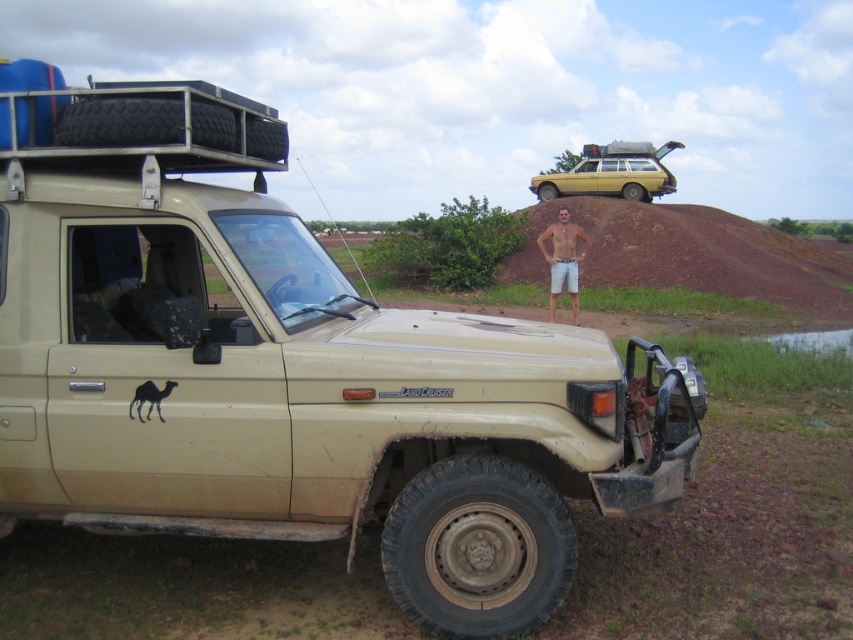
Question: Can you confirm if yellow matte station wagon at upper center is positioned to the right of tan shorts at center?

Choices:
 (A) no
 (B) yes

Answer: (B)

Question: Where is yellow matte station wagon at upper center located in relation to tan shorts at center in the image?

Choices:
 (A) left
 (B) right

Answer: (B)

Question: Among these points, which one is farthest from the camera?

Choices:
 (A) [x=640, y=170]
 (B) [x=553, y=234]

Answer: (A)

Question: Can you confirm if yellow matte station wagon at upper center is smaller than tan shorts at center?

Choices:
 (A) no
 (B) yes

Answer: (A)